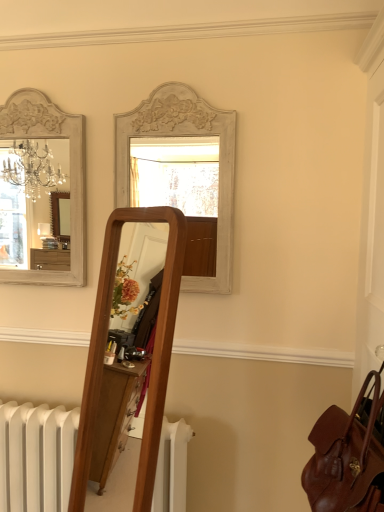
Question: Is white painted wood mirror at upper center, which is counted as the first mirror, starting from the right, a part of leather at right?

Choices:
 (A) yes
 (B) no

Answer: (B)

Question: Is the surface of leather at right in direct contact with white painted wood mirror at upper center, positioned as the 2th mirror in left-to-right order?

Choices:
 (A) no
 (B) yes

Answer: (A)

Question: Can you confirm if leather at right is positioned to the left of white painted wood mirror at upper center, which is counted as the first mirror, starting from the right?

Choices:
 (A) no
 (B) yes

Answer: (A)

Question: From a real-world perspective, is leather at right under white painted wood mirror at upper center, positioned as the 2th mirror in left-to-right order?

Choices:
 (A) no
 (B) yes

Answer: (B)

Question: Is the depth of leather at right less than that of white painted wood mirror at upper center, which is counted as the first mirror, starting from the right?

Choices:
 (A) no
 (B) yes

Answer: (B)

Question: From a real-world perspective, relative to white painted wood mirror at upper left, the 2th mirror from the right, is white painted wood mirror at upper center, which is counted as the first mirror, starting from the right, vertically above or below?

Choices:
 (A) above
 (B) below

Answer: (B)

Question: In terms of height, does white painted wood mirror at upper center, which is counted as the first mirror, starting from the right, look taller or shorter compared to white painted wood mirror at upper left, the 2th mirror from the right?

Choices:
 (A) tall
 (B) short

Answer: (B)

Question: Is white painted wood mirror at upper center, which is counted as the first mirror, starting from the right, situated inside white painted wood mirror at upper left, which is counted as the 1th mirror, starting from the left, or outside?

Choices:
 (A) inside
 (B) outside

Answer: (B)

Question: Relative to white painted wood mirror at upper left, the 2th mirror from the right, is white painted wood mirror at upper center, which is counted as the first mirror, starting from the right, in front or behind?

Choices:
 (A) front
 (B) behind

Answer: (A)

Question: Is point (354, 468) closer or farther from the camera than point (13, 185)?

Choices:
 (A) closer
 (B) farther

Answer: (A)

Question: Looking at their shapes, would you say leather at right is wider or thinner than white painted wood mirror at upper left, which is counted as the 1th mirror, starting from the left?

Choices:
 (A) thin
 (B) wide

Answer: (B)

Question: From a real-world perspective, relative to white painted wood mirror at upper left, the 2th mirror from the right, is leather at right vertically above or below?

Choices:
 (A) below
 (B) above

Answer: (A)

Question: Based on their sizes in the image, would you say leather at right is bigger or smaller than white painted wood mirror at upper left, which is counted as the 1th mirror, starting from the left?

Choices:
 (A) big
 (B) small

Answer: (A)

Question: From the image's perspective, is white painted wood mirror at upper center, positioned as the 2th mirror in left-to-right order, located above or below leather at right?

Choices:
 (A) above
 (B) below

Answer: (A)

Question: Considering the relative positions of white painted wood mirror at upper center, positioned as the 2th mirror in left-to-right order, and leather at right in the image provided, is white painted wood mirror at upper center, positioned as the 2th mirror in left-to-right order, to the left or to the right of leather at right?

Choices:
 (A) left
 (B) right

Answer: (A)